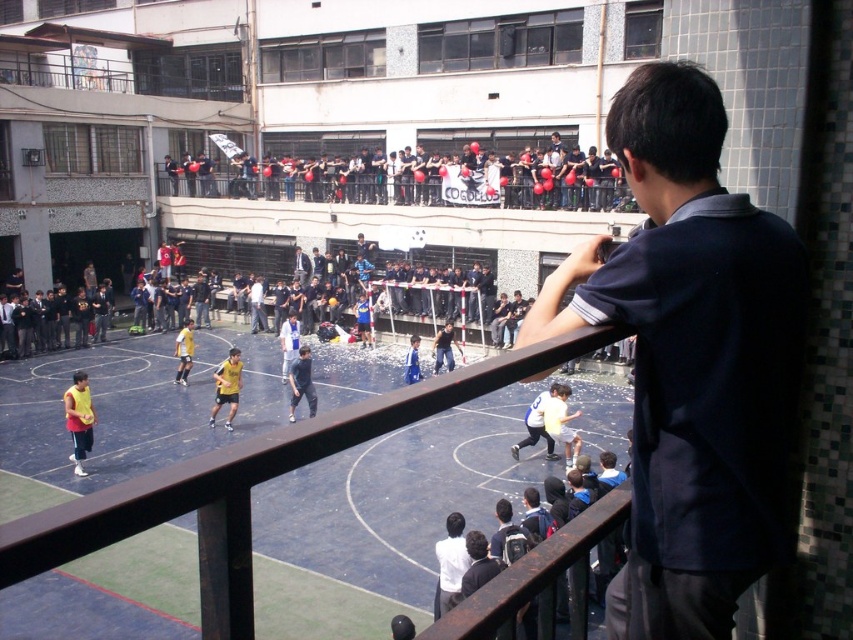
Question: Is black fabric crowd at upper center further to the viewer compared to dark blue jersey at center?

Choices:
 (A) yes
 (B) no

Answer: (B)

Question: Among these points, which one is nearest to the camera?

Choices:
 (A) (422, 307)
 (B) (161, 476)

Answer: (B)

Question: Which of the following is the closest to the observer?

Choices:
 (A) blue rubber basketball court at center
 (B) dark blue shirt at upper right
 (C) yellow jersey at center

Answer: (A)

Question: Does blue rubber basketball court at center have a smaller size compared to yellow jersey at center?

Choices:
 (A) yes
 (B) no

Answer: (B)

Question: From the image, what is the correct spatial relationship of dark blue shirt at upper right in relation to dark blue jersey at center?

Choices:
 (A) right
 (B) left

Answer: (A)

Question: Considering the real-world distances, which object is closest to the dark blue jersey at center?

Choices:
 (A) dark blue shirt at upper right
 (B) black fabric crowd at upper center
 (C) blue rubber basketball court at center

Answer: (B)